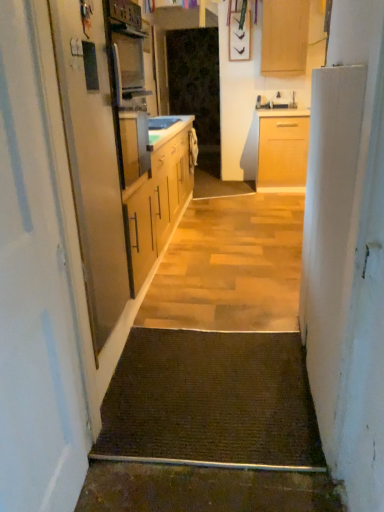
This screenshot has height=512, width=384. Describe the element at coordinates (162, 122) in the screenshot. I see `white glossy sink at center` at that location.

What is the approximate width of light wood cabinet at upper center?

It is 13.71 inches.

This screenshot has height=512, width=384. What do you see at coordinates (34, 293) in the screenshot? I see `white matte door at left` at bounding box center [34, 293].

At what (x,y) coordinates should I click in order to perform the action: click on brown textured mat at center. Please return your answer as a coordinate pair (x, y). Looking at the image, I should click on (211, 402).

How much space does metallic silver screen door at left, the 2th screen door when ordered from right to left, occupy vertically?

metallic silver screen door at left, the 2th screen door when ordered from right to left, is 1.41 meters in height.

Locate an element on the screen. The width and height of the screenshot is (384, 512). transparent plastic screen door at center, arranged as the second screen door when ordered from the bottom is located at coordinates (197, 88).

Visually, is metallic silver screen door at left, the 2th screen door when ordered from right to left, positioned to the left or to the right of white glossy sink at center?

From the image, it's evident that metallic silver screen door at left, the 2th screen door when ordered from right to left, is to the left of white glossy sink at center.

Does point (96, 234) come closer to viewer compared to point (158, 126)?

That is True.

Between metallic silver screen door at left, which appears as the 1th screen door when viewed from the left, and white glossy sink at center, which one is positioned behind?

Positioned behind is white glossy sink at center.

What's the angular difference between metallic silver screen door at left, placed as the first screen door when sorted from front to back, and white glossy sink at center's facing directions?

metallic silver screen door at left, placed as the first screen door when sorted from front to back, and white glossy sink at center are facing 0.823 degrees away from each other.

Is metallic silver screen door at left, which is counted as the 2th screen door, starting from the back, located within brown textured mat at center?

No, metallic silver screen door at left, which is counted as the 2th screen door, starting from the back, is not a part of brown textured mat at center.

In terms of width, does brown textured mat at center look wider or thinner when compared to metallic silver screen door at left, the first screen door positioned from the bottom?

Considering their sizes, brown textured mat at center looks broader than metallic silver screen door at left, the first screen door positioned from the bottom.

Which object is positioned more to the right, brown textured mat at center or metallic silver screen door at left, the 2th screen door when ordered from right to left?

brown textured mat at center is more to the right.

Is brown textured mat at center oriented towards metallic silver screen door at left, the 2th screen door when ordered from right to left?

No, brown textured mat at center is not facing towards metallic silver screen door at left, the 2th screen door when ordered from right to left.

Is point (134, 426) farther from camera compared to point (171, 54)?

No.

From the image's perspective, is brown textured mat at center located above or below transparent plastic screen door at center, placed as the first screen door when sorted from back to front?

brown textured mat at center is situated lower than transparent plastic screen door at center, placed as the first screen door when sorted from back to front, in the image.

From the picture: Are brown textured mat at center and transparent plastic screen door at center, the 1th screen door positioned from the top, far apart?

Yes, brown textured mat at center and transparent plastic screen door at center, the 1th screen door positioned from the top, are quite far apart.

Which is in front, light wood cabinet at upper center or transparent plastic screen door at center, placed as the first screen door when sorted from back to front?

light wood cabinet at upper center is more forward.

Does point (301, 62) come closer to viewer compared to point (203, 86)?

Yes, point (301, 62) is in front of point (203, 86).

Is transparent plastic screen door at center, the 2th screen door positioned from the left, at the back of light wood cabinet at upper center?

No, light wood cabinet at upper center is not facing away from transparent plastic screen door at center, the 2th screen door positioned from the left.

Is light wood cabinet at upper center at the right side of transparent plastic screen door at center, arranged as the 2th screen door when viewed from the front?

Yes.

Considering the points (65, 102) and (219, 177), which point is in front, point (65, 102) or point (219, 177)?

Positioned in front is point (65, 102).

Is metallic silver screen door at left, which is counted as the 2th screen door, starting from the back, far away from transparent plastic screen door at center, the 1th screen door viewed from the right?

Yes, metallic silver screen door at left, which is counted as the 2th screen door, starting from the back, and transparent plastic screen door at center, the 1th screen door viewed from the right, are located far from each other.

Choose the correct answer: Is metallic silver screen door at left, which is counted as the 2th screen door, starting from the back, inside transparent plastic screen door at center, placed as the first screen door when sorted from back to front, or outside it?

metallic silver screen door at left, which is counted as the 2th screen door, starting from the back, cannot be found inside transparent plastic screen door at center, placed as the first screen door when sorted from back to front.

From a real-world perspective, does metallic silver screen door at left, the first screen door positioned from the bottom, stand above transparent plastic screen door at center, arranged as the second screen door when ordered from the bottom?

No, from a real-world perspective, metallic silver screen door at left, the first screen door positioned from the bottom, is not above transparent plastic screen door at center, arranged as the second screen door when ordered from the bottom.

How different are the orientations of white matte door at left and light wood cabinet at upper center in degrees?

The angle between the facing direction of white matte door at left and the facing direction of light wood cabinet at upper center is 93.4 degrees.

Is white matte door at left facing away from light wood cabinet at upper center?

No, white matte door at left is not facing away from light wood cabinet at upper center.

From a real-world perspective, who is located lower, white matte door at left or light wood cabinet at upper center?

In real-world perspective, white matte door at left is lower.

Does white matte door at left appear on the left side of light wood cabinet at upper center?

Yes, white matte door at left is to the left of light wood cabinet at upper center.

From the image's perspective, does white matte door at left appear lower than brown textured mat at center?

Actually, white matte door at left appears above brown textured mat at center in the image.

Is white matte door at left positioned far away from brown textured mat at center?

That's not correct — white matte door at left is a little close to brown textured mat at center.

Would you say brown textured mat at center is part of white matte door at left's contents?

No, brown textured mat at center is not inside white matte door at left.

Locate an element on the screen. The image size is (384, 512). screen door that appears below the white glossy sink at center (from the image's perspective) is located at coordinates (92, 156).

Where is `doormat that appears behind the metallic silver screen door at left, the 2th screen door from the top`? The width and height of the screenshot is (384, 512). doormat that appears behind the metallic silver screen door at left, the 2th screen door from the top is located at coordinates (211, 402).

Based on the photo, which object lies nearer to the anchor point white glossy sink at center, light wood cabinet at upper center or brown textured mat at center?

Based on the image, brown textured mat at center appears to be nearer to white glossy sink at center.

Which object lies further to the anchor point white matte door at left, metallic silver screen door at left, the first screen door positioned from the bottom, or light wood cabinet at upper center?

light wood cabinet at upper center is further to white matte door at left.

Estimate the real-world distances between objects in this image. Which object is closer to transparent plastic screen door at center, placed as the first screen door when sorted from back to front, metallic silver screen door at left, placed as the first screen door when sorted from front to back, or brown textured mat at center?

metallic silver screen door at left, placed as the first screen door when sorted from front to back, lies closer to transparent plastic screen door at center, placed as the first screen door when sorted from back to front, than the other object.

Which object lies further to the anchor point light wood cabinet at upper center, metallic silver screen door at left, the first screen door positioned from the bottom, or white glossy sink at center?

The object further to light wood cabinet at upper center is metallic silver screen door at left, the first screen door positioned from the bottom.

From the image, which object appears to be farther from light wood cabinet at upper center, white matte door at left or transparent plastic screen door at center, the 1th screen door positioned from the top?

Based on the image, white matte door at left appears to be further to light wood cabinet at upper center.

Estimate the real-world distances between objects in this image. Which object is closer to light wood cabinet at upper center, metallic silver screen door at left, placed as the first screen door when sorted from front to back, or brown textured mat at center?

The object closer to light wood cabinet at upper center is metallic silver screen door at left, placed as the first screen door when sorted from front to back.

Which object lies further to the anchor point brown textured mat at center, transparent plastic screen door at center, the 1th screen door positioned from the top, or white matte door at left?

Based on the image, transparent plastic screen door at center, the 1th screen door positioned from the top, appears to be further to brown textured mat at center.

Consider the image. Based on their spatial positions, is metallic silver screen door at left, the 2th screen door when ordered from right to left, or white matte door at left closer to white glossy sink at center?

Based on the image, metallic silver screen door at left, the 2th screen door when ordered from right to left, appears to be nearer to white glossy sink at center.

Identify the location of screen door between white matte door at left and brown textured mat at center in the front-back direction. This screenshot has height=512, width=384. (92, 156).

Locate an element on the screen. Image resolution: width=384 pixels, height=512 pixels. screen door between white matte door at left and light wood cabinet at upper center from front to back is located at coordinates (92, 156).

Where is `sink located between metallic silver screen door at left, which is counted as the 2th screen door, starting from the back, and transparent plastic screen door at center, placed as the first screen door when sorted from back to front, in the depth direction`? sink located between metallic silver screen door at left, which is counted as the 2th screen door, starting from the back, and transparent plastic screen door at center, placed as the first screen door when sorted from back to front, in the depth direction is located at coordinates (162, 122).

Locate an element on the screen. doormat between white matte door at left and white glossy sink at center in the front-back direction is located at coordinates (211, 402).